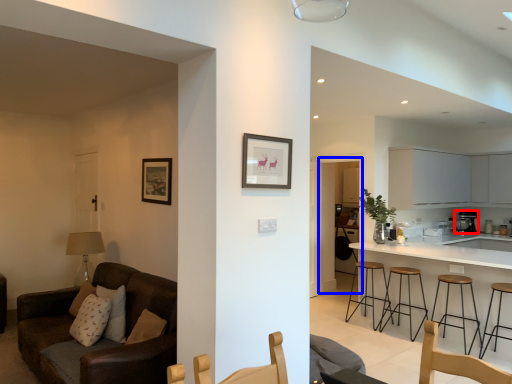
Question: Which of the following is the farthest to the observer, appliance (highlighted by a red box) or glass door (highlighted by a blue box)?

Choices:
 (A) appliance
 (B) glass door

Answer: (A)